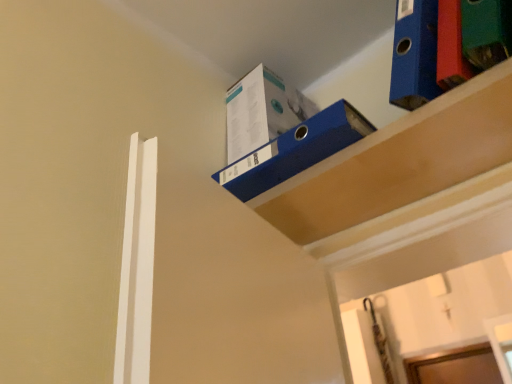
Question: Can you confirm if blue cardboard box at upper right, the first shelf viewed from the right, is shorter than blue cardboard box at upper center?

Choices:
 (A) no
 (B) yes

Answer: (B)

Question: Could you tell me if blue cardboard box at upper right, the first shelf viewed from the right, is turned towards blue cardboard box at upper center?

Choices:
 (A) no
 (B) yes

Answer: (A)

Question: Considering the relative positions of blue cardboard box at upper right, the 2th shelf from the left, and blue cardboard box at upper center in the image provided, is blue cardboard box at upper right, the 2th shelf from the left, to the left of blue cardboard box at upper center from the viewer's perspective?

Choices:
 (A) yes
 (B) no

Answer: (B)

Question: Does blue cardboard box at upper right, the first shelf viewed from the right, have a larger size compared to blue cardboard box at upper center?

Choices:
 (A) no
 (B) yes

Answer: (A)

Question: From a real-world perspective, is blue cardboard box at upper right, the 2th shelf from the left, over blue cardboard box at upper center?

Choices:
 (A) yes
 (B) no

Answer: (B)

Question: In the image, is blue cardboard box at upper center, which ranks as the second shelf in right-to-left order, positioned in front of or behind blue cardboard box at upper center?

Choices:
 (A) behind
 (B) front

Answer: (B)

Question: Considering the relative positions of blue cardboard box at upper center, which ranks as the second shelf in right-to-left order, and blue cardboard box at upper center in the image provided, is blue cardboard box at upper center, which ranks as the second shelf in right-to-left order, to the left or to the right of blue cardboard box at upper center?

Choices:
 (A) right
 (B) left

Answer: (A)

Question: Considering the positions of point (266, 183) and point (252, 140), is point (266, 183) closer or farther from the camera than point (252, 140)?

Choices:
 (A) farther
 (B) closer

Answer: (B)

Question: From the image's perspective, is blue cardboard box at upper center, which ranks as the second shelf in right-to-left order, located above or below blue cardboard box at upper center?

Choices:
 (A) below
 (B) above

Answer: (A)

Question: Relative to blue cardboard box at upper center, marked as the first shelf in a left-to-right arrangement, is blue cardboard box at upper right, the first shelf viewed from the right, in front or behind?

Choices:
 (A) behind
 (B) front

Answer: (B)

Question: Based on their sizes in the image, would you say blue cardboard box at upper right, the first shelf viewed from the right, is bigger or smaller than blue cardboard box at upper center, which ranks as the second shelf in right-to-left order?

Choices:
 (A) big
 (B) small

Answer: (B)

Question: In terms of height, does blue cardboard box at upper right, the first shelf viewed from the right, look taller or shorter compared to blue cardboard box at upper center, marked as the first shelf in a left-to-right arrangement?

Choices:
 (A) tall
 (B) short

Answer: (B)

Question: Looking at their shapes, would you say blue cardboard box at upper right, the 2th shelf from the left, is wider or thinner than blue cardboard box at upper center, marked as the first shelf in a left-to-right arrangement?

Choices:
 (A) thin
 (B) wide

Answer: (A)

Question: From the image's perspective, is blue cardboard box at upper center located above or below blue cardboard box at upper center, marked as the first shelf in a left-to-right arrangement?

Choices:
 (A) above
 (B) below

Answer: (A)

Question: Is blue cardboard box at upper center wider or thinner than blue cardboard box at upper center, marked as the first shelf in a left-to-right arrangement?

Choices:
 (A) thin
 (B) wide

Answer: (A)